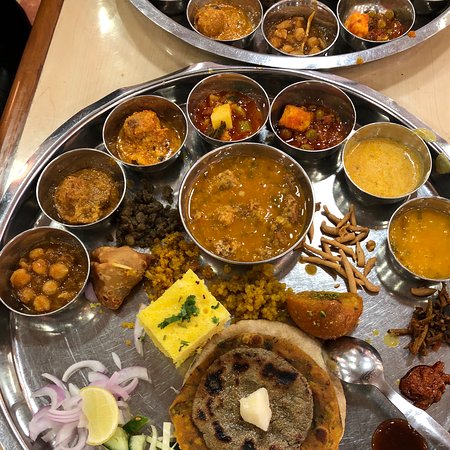
Identify the location of food tray. This screenshot has height=450, width=450. (385, 337), (179, 15).